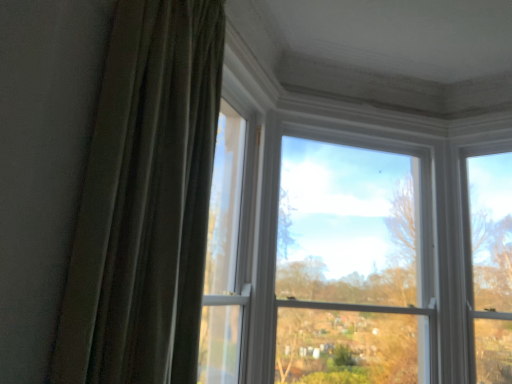
Describe the element at coordinates (145, 200) in the screenshot. Image resolution: width=512 pixels, height=384 pixels. I see `green velvet curtain at left` at that location.

In order to click on green velvet curtain at left in this screenshot , I will do `click(145, 200)`.

Where is `clear glass window at center`? This screenshot has width=512, height=384. clear glass window at center is located at coordinates (354, 262).

Describe the element at coordinates (354, 262) in the screenshot. The height and width of the screenshot is (384, 512). I see `clear glass window at center` at that location.

Find the location of `green velvet curtain at left`. green velvet curtain at left is located at coordinates (145, 200).

Does clear glass window at center appear on the left side of green velvet curtain at left?

No.

Considering the relative positions of clear glass window at center and green velvet curtain at left in the image provided, is clear glass window at center in front of green velvet curtain at left?

No.

Is point (344, 219) farther from camera compared to point (151, 216)?

That is True.

From the image's perspective, is clear glass window at center below green velvet curtain at left?

Correct, clear glass window at center appears lower than green velvet curtain at left in the image.

From a real-world perspective, is clear glass window at center positioned above or below green velvet curtain at left?

Clearly, from a real-world perspective, clear glass window at center is below green velvet curtain at left.

Considering the sizes of objects clear glass window at center and green velvet curtain at left in the image provided, who is thinner, clear glass window at center or green velvet curtain at left?

clear glass window at center is thinner.

Considering the relative sizes of clear glass window at center and green velvet curtain at left in the image provided, is clear glass window at center shorter than green velvet curtain at left?

In fact, clear glass window at center may be taller than green velvet curtain at left.

Considering the sizes of objects clear glass window at center and green velvet curtain at left in the image provided, who is smaller, clear glass window at center or green velvet curtain at left?

With smaller size is green velvet curtain at left.

Can green velvet curtain at left be found inside clear glass window at center?

Actually, green velvet curtain at left is outside clear glass window at center.

Is clear glass window at center not close to green velvet curtain at left?

Yes, clear glass window at center and green velvet curtain at left are quite far apart.

Is green velvet curtain at left at the back of clear glass window at center?

clear glass window at center is not turned away from green velvet curtain at left.

Image resolution: width=512 pixels, height=384 pixels. What are the coordinates of `curtain in front of the clear glass window at center` in the screenshot? It's located at (145, 200).

Would you say green velvet curtain at left is to the left or to the right of clear glass window at center in the picture?

Clearly, green velvet curtain at left is on the left of clear glass window at center in the image.

Is green velvet curtain at left closer to the viewer compared to clear glass window at center?

That is True.

Which is behind, point (167, 326) or point (382, 285)?

Positioned behind is point (382, 285).

From the image's perspective, who appears lower, green velvet curtain at left or clear glass window at center?

From the image's view, clear glass window at center is below.

From a real-world perspective, relative to clear glass window at center, is green velvet curtain at left vertically above or below?

In terms of real-world spatial position, green velvet curtain at left is above clear glass window at center.

Which object is wider, green velvet curtain at left or clear glass window at center?

With larger width is green velvet curtain at left.

Does green velvet curtain at left have a lesser height compared to clear glass window at center?

Yes, green velvet curtain at left is shorter than clear glass window at center.

Does green velvet curtain at left have a larger size compared to clear glass window at center?

Incorrect, green velvet curtain at left is not larger than clear glass window at center.

Is green velvet curtain at left positioned beyond the bounds of clear glass window at center?

Yes.

Is green velvet curtain at left not close to clear glass window at center?

green velvet curtain at left is far away from clear glass window at center.

Is green velvet curtain at left positioned with its back to clear glass window at center?

green velvet curtain at left does not have its back to clear glass window at center.

How many degrees apart are the facing directions of green velvet curtain at left and clear glass window at center?

They differ by 57.1 degrees in their facing directions.

In the image, there is a green velvet curtain at left. Identify the location of bay window below it (from a real-world perspective). (354, 262).

Identify the location of bay window that appears below the green velvet curtain at left (from the image's perspective). (354, 262).

Find the location of a particular element. The height and width of the screenshot is (384, 512). curtain on the left of clear glass window at center is located at coordinates [x=145, y=200].